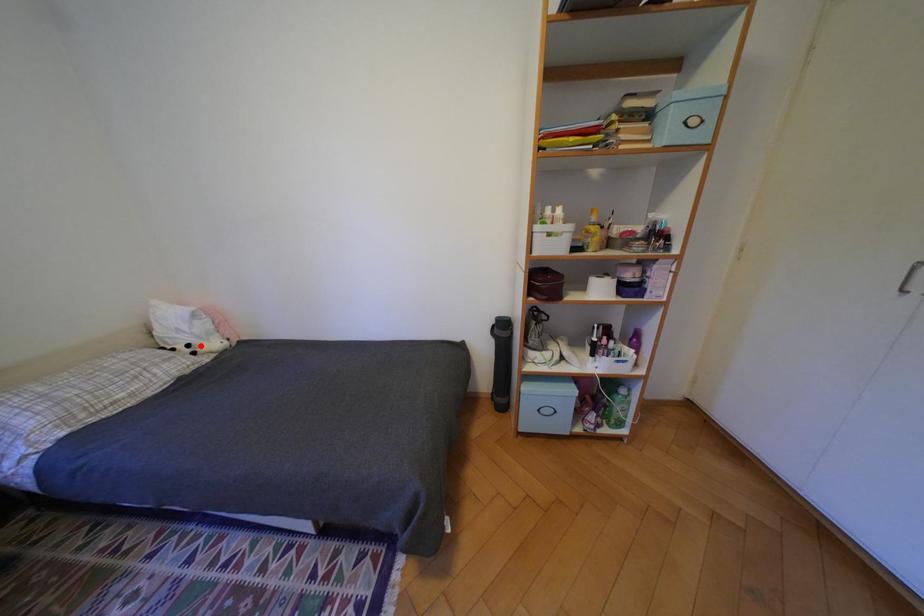
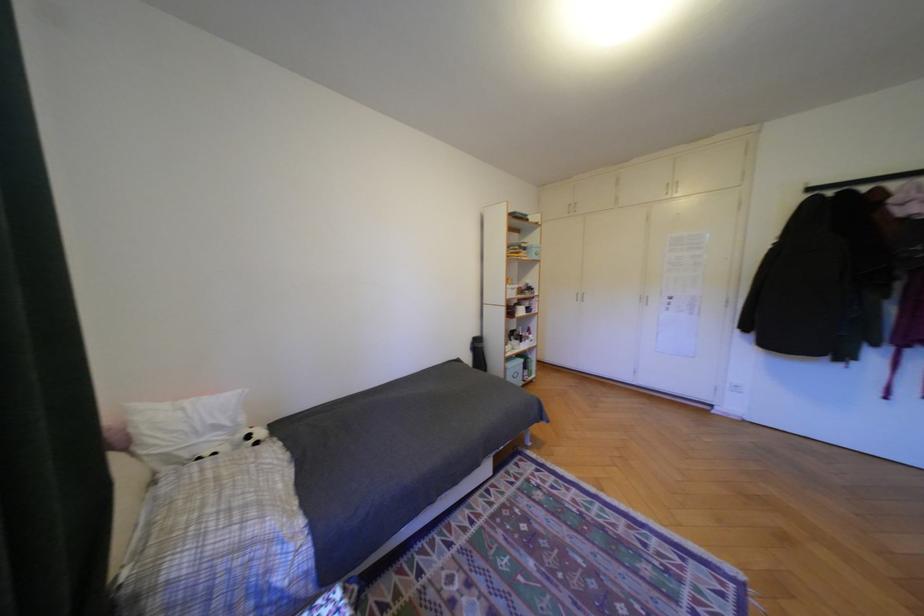
In the second image, find the point that corresponds to the highlighted location in the first image.

(261, 437)